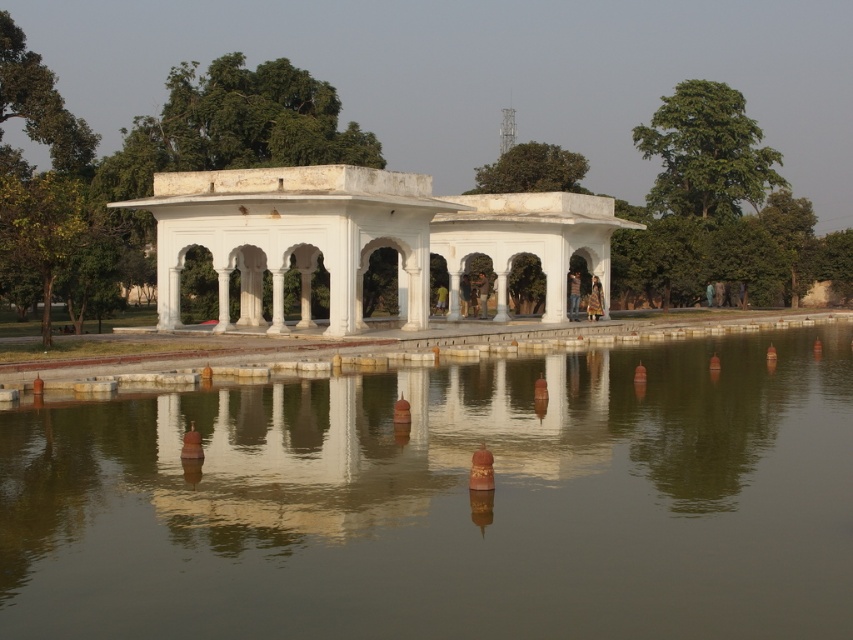
Is dark brown leather jacket at center bigger than brown leather jacket at center?

Yes, dark brown leather jacket at center is bigger than brown leather jacket at center.

Can you confirm if dark brown leather jacket at center is positioned below brown leather jacket at center?

Incorrect, dark brown leather jacket at center is not positioned below brown leather jacket at center.

Locate an element on the screen. This screenshot has width=853, height=640. dark brown leather jacket at center is located at coordinates (573, 294).

Between point (764, 595) and point (492, 227), which one is positioned behind?

The point (492, 227) is more distant.

Is point (300, 518) behind point (291, 218)?

That is False.

Between point (363, 552) and point (250, 259), which one is positioned in front?

Positioned in front is point (363, 552).

Image resolution: width=853 pixels, height=640 pixels. Find the location of `smooth reflective water at center`. smooth reflective water at center is located at coordinates point(448,502).

Can you confirm if white marble gazebo at center is taller than golden fabric dress at center?

Yes.

Looking at this image, can you confirm if white marble gazebo at center is smaller than golden fabric dress at center?

No, white marble gazebo at center is not smaller than golden fabric dress at center.

In order to click on white marble gazebo at center in this screenshot , I will do `click(360, 237)`.